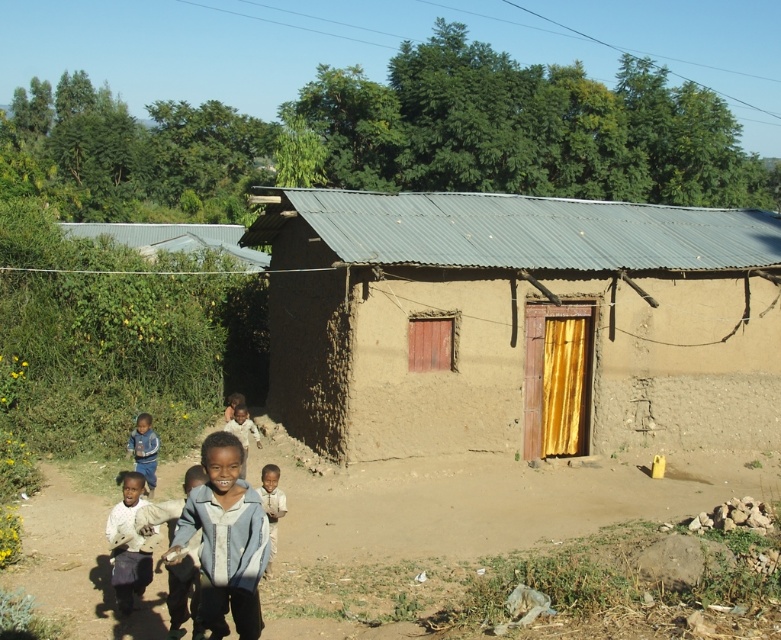
Question: Does light blue denim jacket at center have a larger size compared to blue denim jacket at lower left?

Choices:
 (A) no
 (B) yes

Answer: (B)

Question: Which point appears farthest from the camera in this image?

Choices:
 (A) (201, 490)
 (B) (187, 580)
 (C) (560, 250)

Answer: (C)

Question: Is brown mud hut at center wider than blue denim jacket at lower left?

Choices:
 (A) no
 (B) yes

Answer: (B)

Question: Is the position of light gray cotton shirt at lower left less distant than that of light blue denim jacket at center?

Choices:
 (A) no
 (B) yes

Answer: (A)

Question: Which of the following is the farthest from the observer?

Choices:
 (A) blue denim jacket at lower left
 (B) light blue denim jacket at lower center
 (C) light brown skin at center

Answer: (C)

Question: Which object is farther from the camera taking this photo?

Choices:
 (A) light brown skin at center
 (B) light blue denim jacket at lower center
 (C) light brown skin at lower center
 (D) blue denim jacket at lower left

Answer: (A)